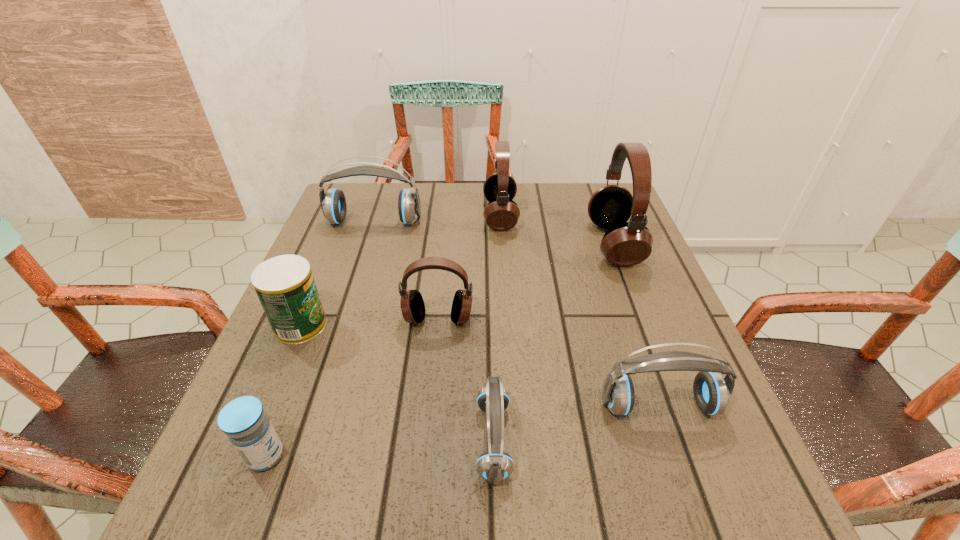
At what (x,y) coordinates should I click in order to perform the action: click on the rightmost black headset. Please return your answer as a coordinate pair (x, y). Image resolution: width=960 pixels, height=540 pixels. Looking at the image, I should click on (625, 244).

The height and width of the screenshot is (540, 960). What are the coordinates of `the tallest headset` in the screenshot? It's located at (625, 244).

In order to click on the second biggest black headset in this screenshot , I will do 501,213.

You are a GUI agent. You are given a task and a screenshot of the screen. Output one action in this format:
    pyautogui.click(x=<x>, y=<y>)
    Task: Click on the farthest blue headset
    
    Given the screenshot: What is the action you would take?
    pyautogui.click(x=333, y=203)

Where is `the leftmost blue headset`? the leftmost blue headset is located at coordinates (333, 203).

The width and height of the screenshot is (960, 540). I want to click on the nearest black headset, so click(412, 304).

Locate an element on the screen. the smallest black headset is located at coordinates (412, 304).

Identify the location of the second smallest blue headset. This screenshot has height=540, width=960. (712, 392).

Locate an element on the screen. The image size is (960, 540). can is located at coordinates (285, 286).

Where is `medicine`? This screenshot has height=540, width=960. medicine is located at coordinates (243, 420).